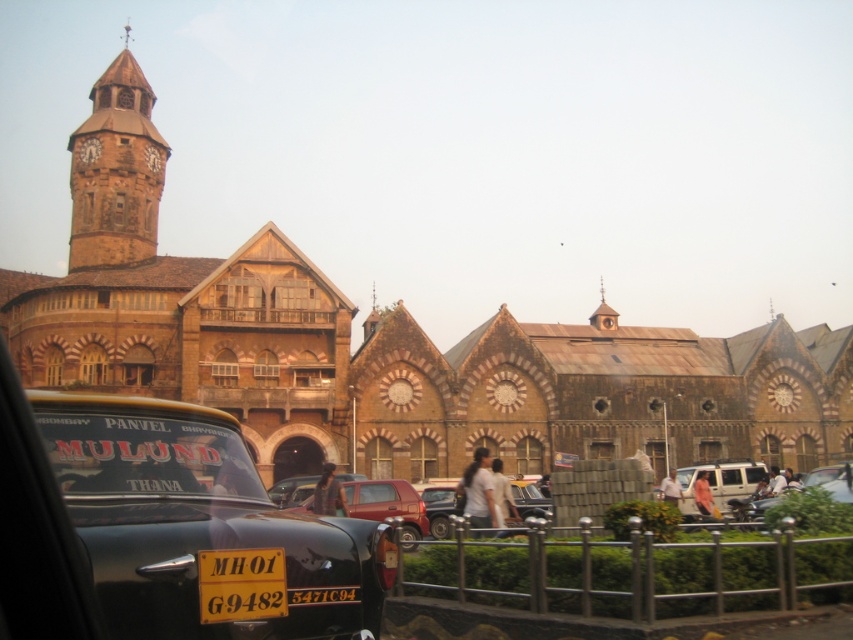
Based on the photo, is shiny black taxi at lower left bigger than white matte van at center?

Yes.

Is point (207, 465) less distant than point (701, 470)?

That is True.

Identify the location of shiny black taxi at lower left. The height and width of the screenshot is (640, 853). (202, 528).

Is metallic red suv at center above metallic silver car at center?

No, metallic red suv at center is not above metallic silver car at center.

Is metallic red suv at center shorter than metallic silver car at center?

Incorrect, metallic red suv at center's height does not fall short of metallic silver car at center's.

Does point (397, 502) come in front of point (427, 516)?

Yes.

Find the location of a particular element. metallic red suv at center is located at coordinates (387, 506).

Who is positioned more to the right, metallic silver car at center or metallic silver van at center?

metallic silver van at center

Who is more forward, (448, 513) or (838, 488)?

Positioned in front is point (448, 513).

The width and height of the screenshot is (853, 640). Find the location of `metallic silver car at center`. metallic silver car at center is located at coordinates (439, 509).